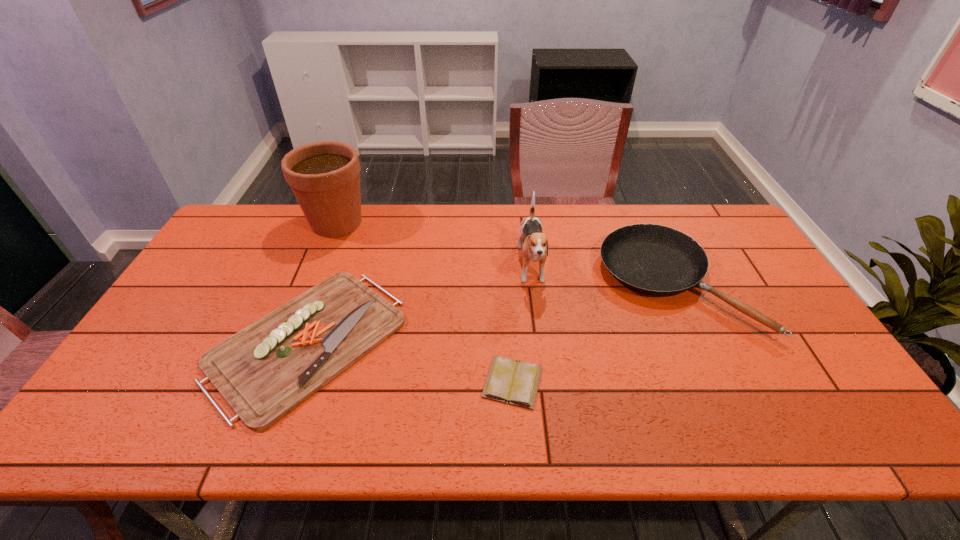
In the image, there is a desktop. Where is `free region at the left edge`? Image resolution: width=960 pixels, height=540 pixels. free region at the left edge is located at coordinates (203, 325).

Image resolution: width=960 pixels, height=540 pixels. I want to click on free space at the right edge of the desktop, so click(x=799, y=338).

Locate an element on the screen. This screenshot has height=540, width=960. free space at the near left corner is located at coordinates (132, 445).

Locate an element on the screen. The image size is (960, 540). vacant area at the far right corner of the desktop is located at coordinates [702, 230].

The height and width of the screenshot is (540, 960). Find the location of `free space between the second tallest object and the diary`. free space between the second tallest object and the diary is located at coordinates (522, 325).

Locate an element on the screen. free space between the flowerpot and the diary is located at coordinates (424, 302).

This screenshot has width=960, height=540. In order to click on free space that is in between the third tallest object and the flowerpot in this screenshot , I will do `click(506, 253)`.

The image size is (960, 540). What are the coordinates of `vacant point located between the frying pan and the diary` in the screenshot? It's located at (593, 333).

What are the coordinates of `vacant point located between the shortest object and the fourth shortest object` in the screenshot? It's located at (522, 325).

Where is `free space between the diary and the chopping board`? free space between the diary and the chopping board is located at coordinates (410, 361).